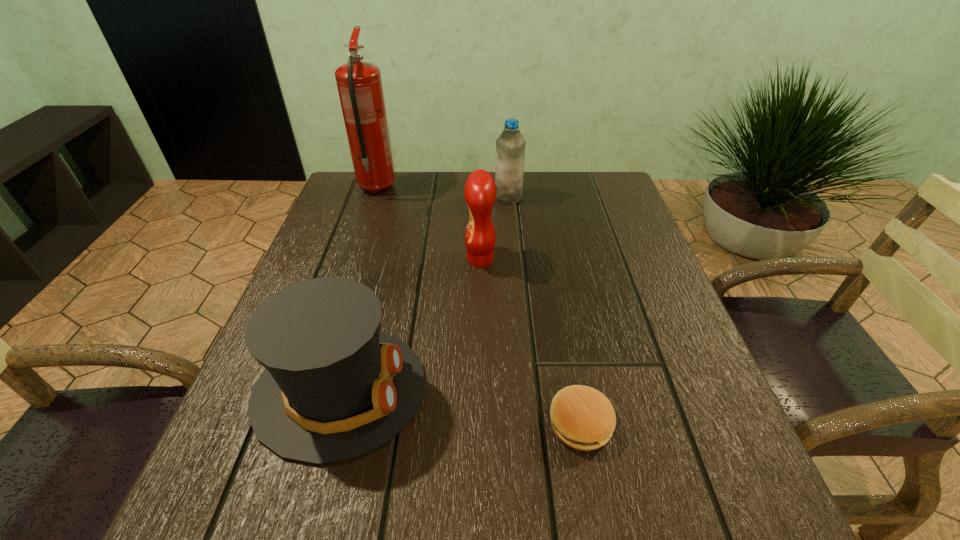
The height and width of the screenshot is (540, 960). In order to click on vacant space at the far left corner of the desktop in this screenshot , I will do `click(359, 209)`.

This screenshot has width=960, height=540. I want to click on vacant space at the near left corner of the desktop, so 235,533.

This screenshot has height=540, width=960. In order to click on free space at the far right corner in this screenshot , I will do `click(632, 213)`.

Image resolution: width=960 pixels, height=540 pixels. What are the coordinates of `empty space that is in between the tallest object and the shortest object` in the screenshot? It's located at (478, 306).

Identify the location of free point between the water bottle and the fourth tallest object. The height and width of the screenshot is (540, 960). (424, 294).

Find the location of `vacant space that is in between the second shortest object and the water bottle`. vacant space that is in between the second shortest object and the water bottle is located at coordinates (424, 294).

Locate an element on the screen. free point between the third farthest object and the dress hat is located at coordinates (410, 325).

In order to click on free space between the third farthest object and the dress hat in this screenshot , I will do (x=410, y=325).

Where is `vacant area that lies between the patty and the tallest object`? vacant area that lies between the patty and the tallest object is located at coordinates (478, 306).

The height and width of the screenshot is (540, 960). I want to click on empty space between the dress hat and the shortest object, so 460,407.